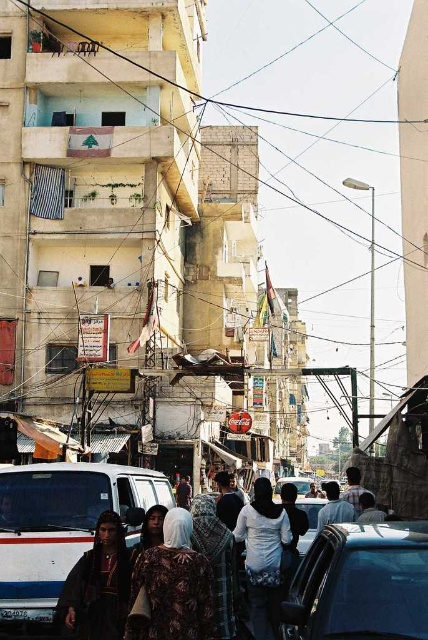
Is point (311, 632) positioned after point (92, 612)?

No, (311, 632) is in front of (92, 612).

Can you confirm if shiny black car at center is thinner than dark brown leather jacket at center?

No, shiny black car at center is not thinner than dark brown leather jacket at center.

Is point (363, 536) behind point (62, 611)?

No.

Locate an element on the screen. shiny black car at center is located at coordinates (360, 584).

How distant is dark brown leather jacket at center from white fabric headscarf at center?

dark brown leather jacket at center is 8.08 meters from white fabric headscarf at center.

Which is behind, point (77, 637) or point (270, 616)?

Point (270, 616)

Does point (115, 596) lie in front of point (264, 595)?

Yes.

Find the location of `dark brown leather jacket at center`. dark brown leather jacket at center is located at coordinates (98, 586).

Who is more forward, (379, 609) or (166, 624)?

Point (379, 609) is more forward.

Does shiny black car at center have a lesser height compared to floral fabric dress at center?

Incorrect, shiny black car at center's height does not fall short of floral fabric dress at center's.

Is point (400, 524) in front of point (180, 552)?

No, (400, 524) is further to viewer.

Identify the location of shiny black car at center. (360, 584).